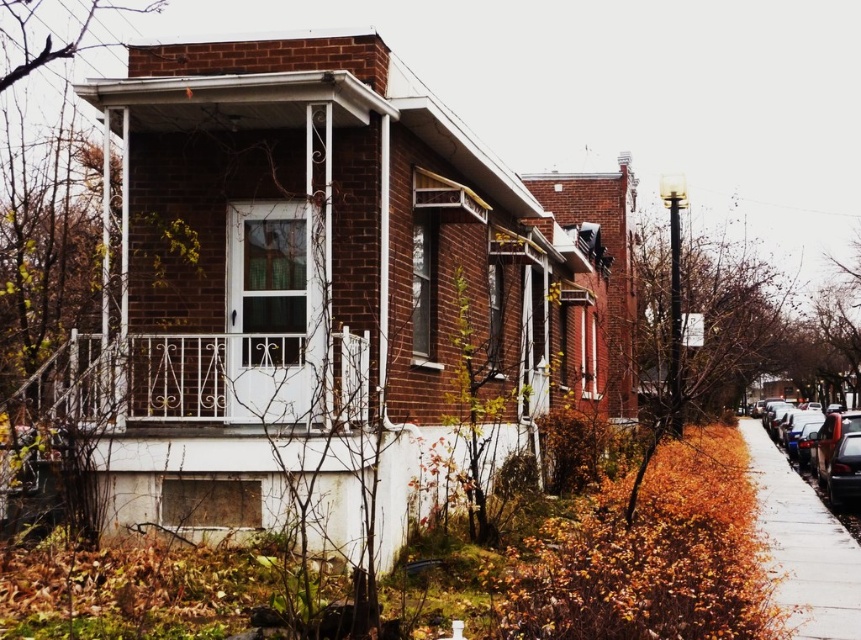
Consider the image. You are a delivery person trying to park your delivery van near the shiny black sedan at right. The sidewalk is for pedestrians. Can you park your van on the concrete sidewalk at lower right?

The concrete sidewalk at lower right is in front of the shiny black sedan at right, meaning it is located in front of the vehicle. However, since the sidewalk is designated for pedestrians, parking the van there would be prohibited. Please find an appropriate parking spot away from the sidewalk.

You are a delivery person trying to park your van. The van requires a space larger than the white wrought iron porch at center. Is there enough space on the concrete sidewalk at lower right to park?

The white wrought iron porch at center is smaller than the concrete sidewalk at lower right, so yes, the concrete sidewalk at lower right is large enough to accommodate the van since it is bigger than the porch.

You are standing at the point marked as point (208,378) on the image. What object are you currently standing on?

You are standing on the white wrought iron porch at center.